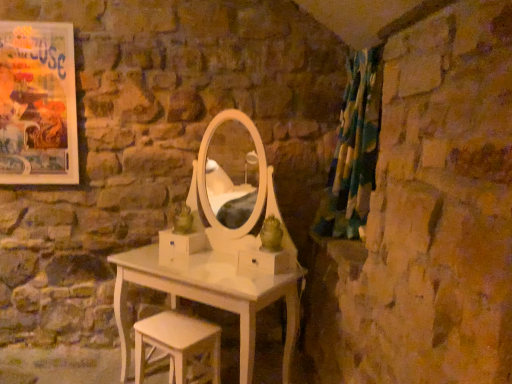
Find the location of a particular element. Image resolution: width=512 pixels, height=384 pixels. vacant point above white wood stool at lower center (from a real-world perspective) is located at coordinates (174, 331).